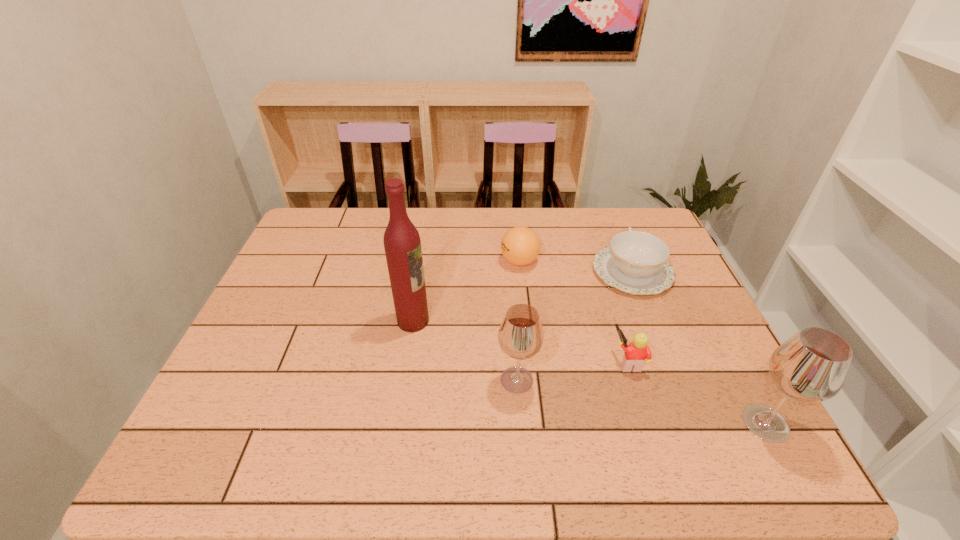
Where is `blank space located 0.100m on the back of the taller wineglass`? This screenshot has height=540, width=960. blank space located 0.100m on the back of the taller wineglass is located at coordinates (733, 363).

Locate an element on the screen. The height and width of the screenshot is (540, 960). vacant space located on the label of the leftmost object is located at coordinates (475, 321).

Find the location of `vacant space situated on the handle side of the shortest object`. vacant space situated on the handle side of the shortest object is located at coordinates (615, 230).

Identify the location of vacant space located on the handle side of the shortest object. The image size is (960, 540). (611, 217).

This screenshot has width=960, height=540. Identify the location of free region located 0.140m on the handle side of the shortest object. (612, 224).

Identify the location of vacant space located on the side with brand of the ping-pong ball. (382, 261).

This screenshot has width=960, height=540. In order to click on blank space located 0.060m on the side with brand of the ping-pong ball in this screenshot , I will do `click(481, 261)`.

The image size is (960, 540). I want to click on free spot located on the side with brand of the ping-pong ball, so click(x=451, y=261).

This screenshot has height=540, width=960. I want to click on vacant space situated 0.110m in front of the Lego with the accessory visible, so click(566, 361).

Where is `vacant space located 0.270m in front of the Lego with the accessory visible`? vacant space located 0.270m in front of the Lego with the accessory visible is located at coordinates (499, 361).